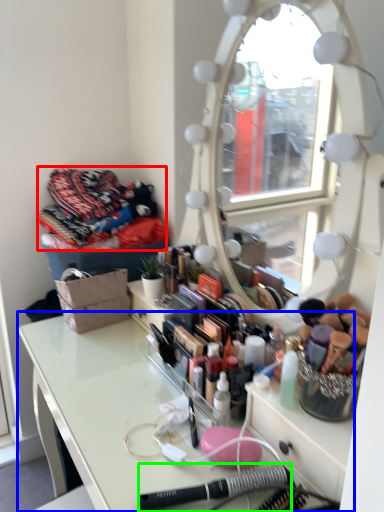
Question: Which is nearer to the clothing (highlighted by a red box)? table (highlighted by a blue box) or equipment (highlighted by a green box).

Choices:
 (A) table
 (B) equipment

Answer: (A)